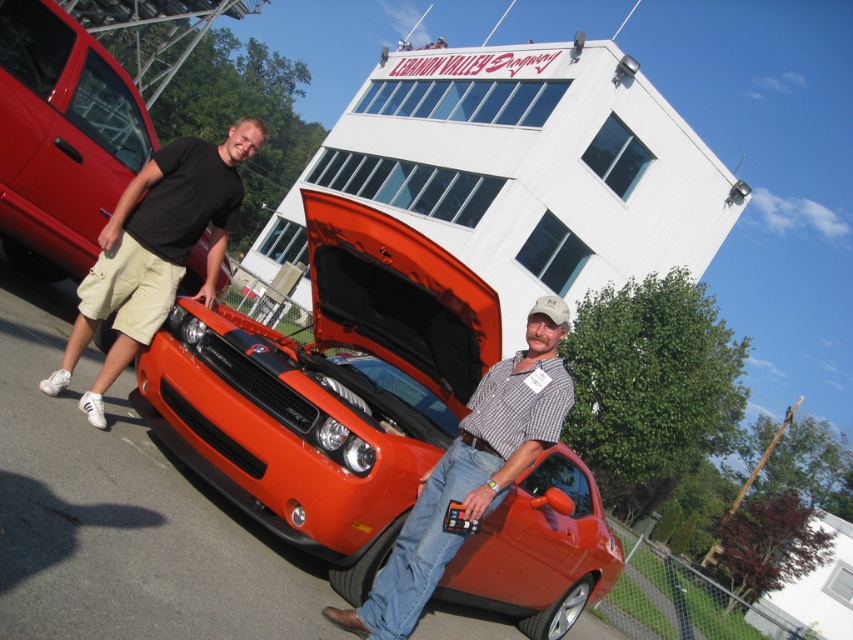
You are a photographer at the Lemmon Valley Dragway and need to position your camera to capture both the shiny orange car at center and the matte black car at left in the same frame. Given that the camera can only accommodate a width of 10 meters, will both cars fit if the total width of the two cars combined is 8 meters?

The shiny orange car at center is wider than the matte black car at left. Since their combined width is 8 meters, which is less than the camera frame width of 10 meters, both cars will fit in the frame.

You are a photographer at the Lemmon Valley Dragway. You need to capture a photo of the shiny orange car at center and the checkered fabric shirt at center. According to the scene, which object is located to the left when facing the dragway?

The shiny orange car at center is positioned on the left side of checkered fabric shirt at center, so the shiny orange car at center is to the left of the checkered fabric shirt at center when facing the dragway.

You are at the Lemmon Valley Dragway and need to determine the relative positions of two points marked on a map. The first point is at coordinates point (579, 499), and the second is at point (42, 4). From your current position, which point is located behind the other?

Point (579, 499) is behind point (42, 4).